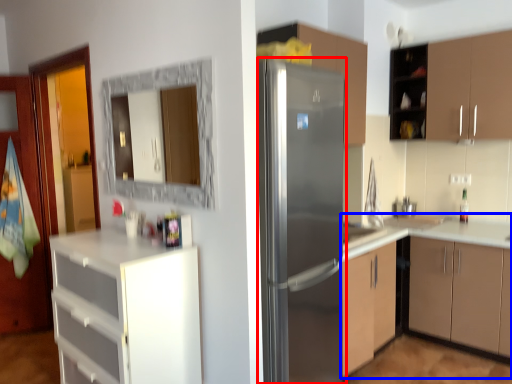
Question: Which point is further to the camera, refrigerator (highlighted by a red box) or cabinetry (highlighted by a blue box)?

Choices:
 (A) refrigerator
 (B) cabinetry

Answer: (B)